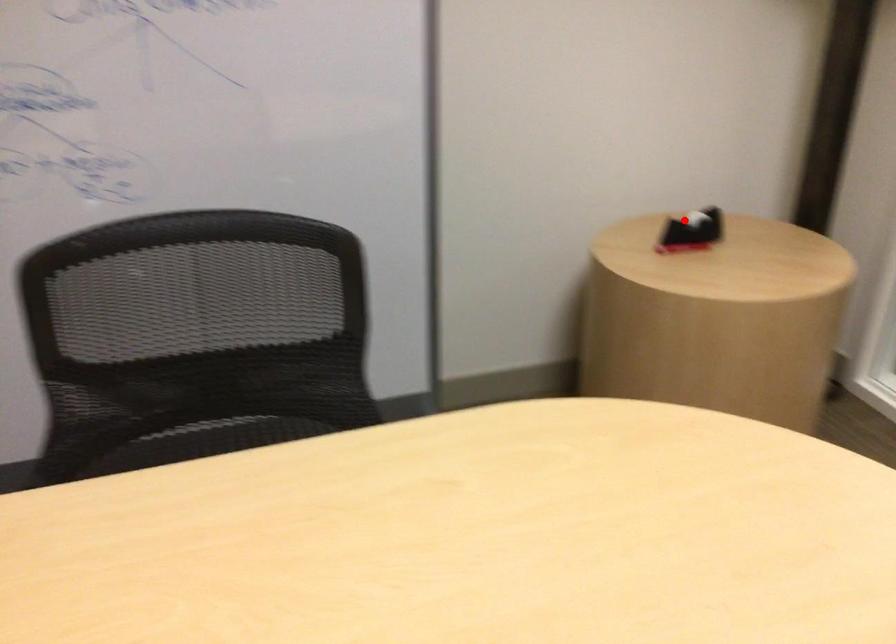
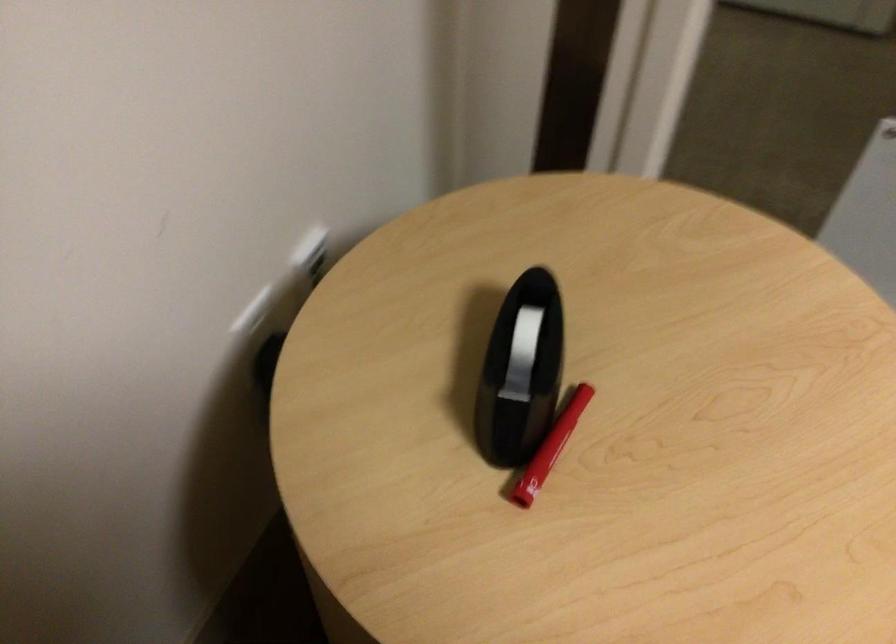
Find the pixel in the second image that matches the highlighted location in the first image.

(521, 354)